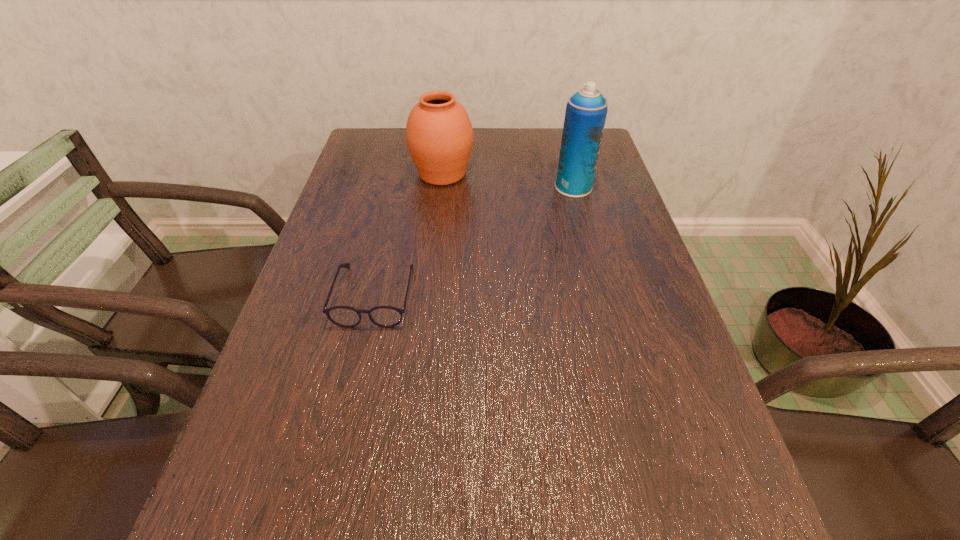
The image size is (960, 540). In order to click on vacant area that lies between the aerosol can and the nearest object in this screenshot , I will do click(474, 241).

The width and height of the screenshot is (960, 540). Identify the location of free space between the urn and the aerosol can. (508, 180).

The image size is (960, 540). Identify the location of free space between the rightmost object and the urn. (508, 180).

Locate an element on the screen. The height and width of the screenshot is (540, 960). vacant area between the second shortest object and the nearest object is located at coordinates [409, 234].

Select which object appears as the closest to the second shortest object. Please provide its 2D coordinates. Your answer should be formatted as a tuple, i.e. [(x, y)], where the tuple contains the x and y coordinates of a point satisfying the conditions above.

[(586, 110)]

Identify which object is the nearest to the spectacles. Please provide its 2D coordinates. Your answer should be formatted as a tuple, i.e. [(x, y)], where the tuple contains the x and y coordinates of a point satisfying the conditions above.

[(439, 135)]